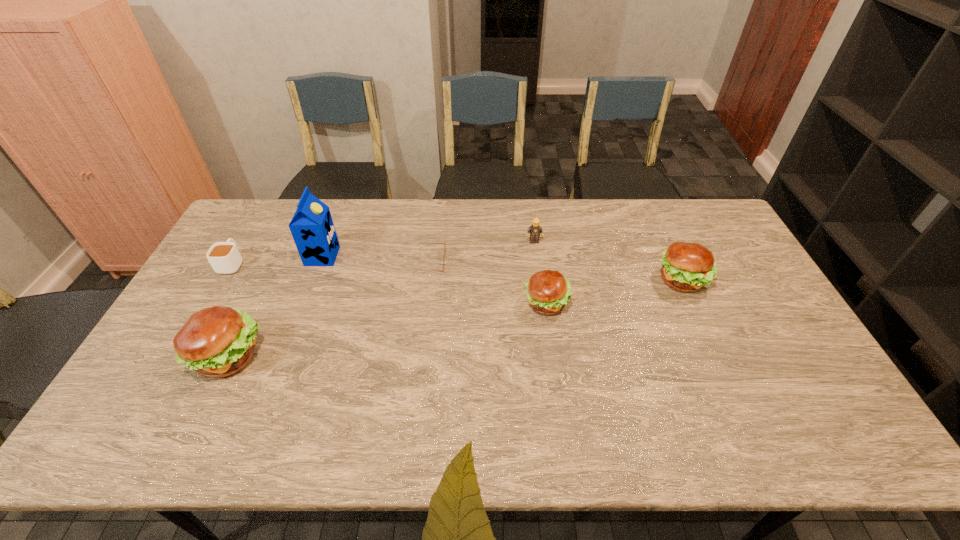
In order to click on vacant position for inserting another hamburger evenly in this screenshot , I will do `click(396, 328)`.